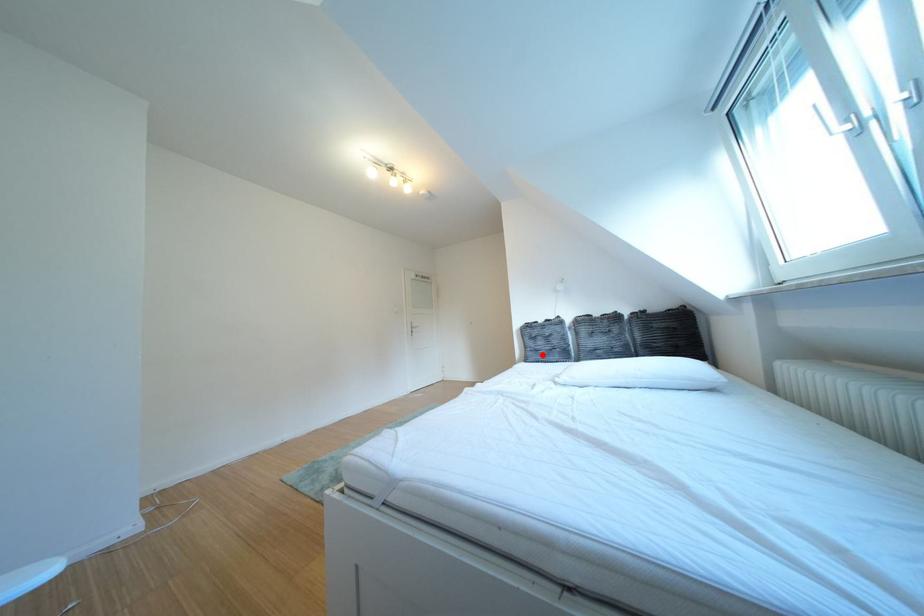
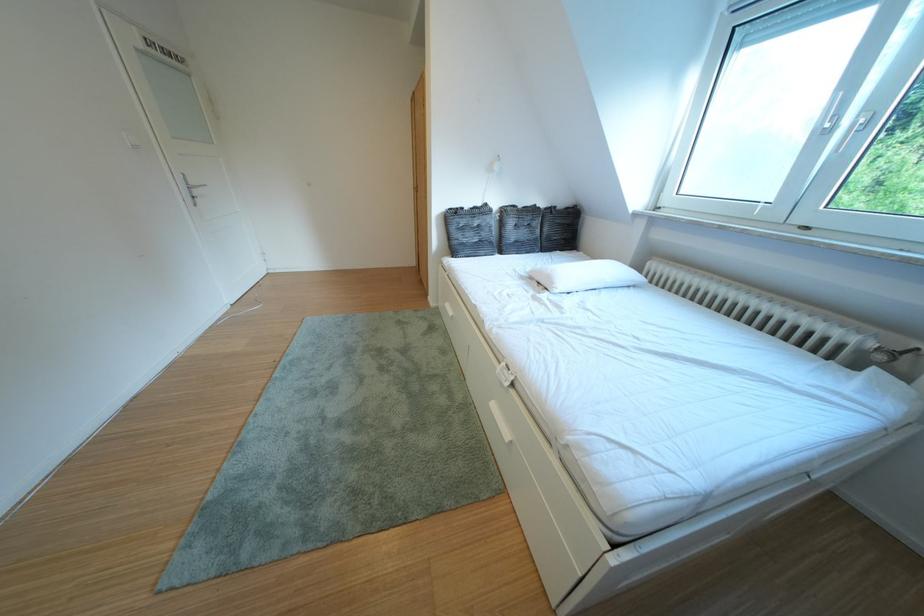
In the second image, find the point that corresponds to the highlighted location in the first image.

(468, 246)